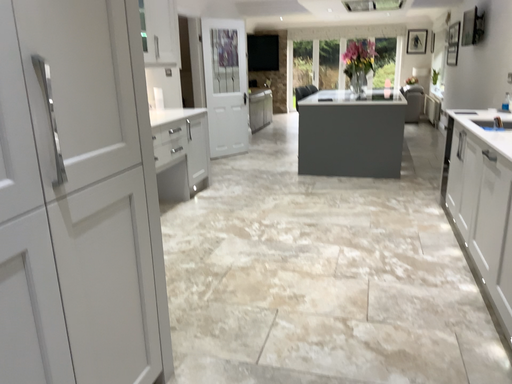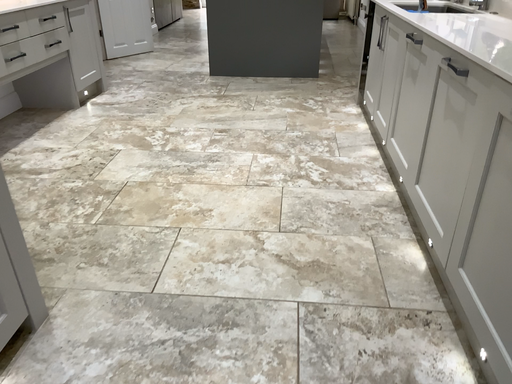
Question: Which way did the camera rotate in the video?

Choices:
 (A) rotated left
 (B) rotated right

Answer: (B)